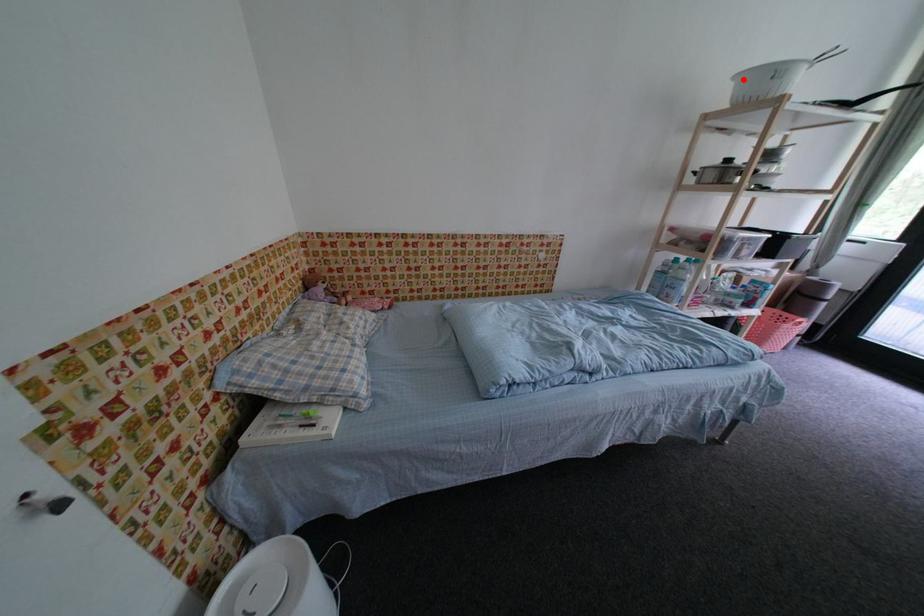
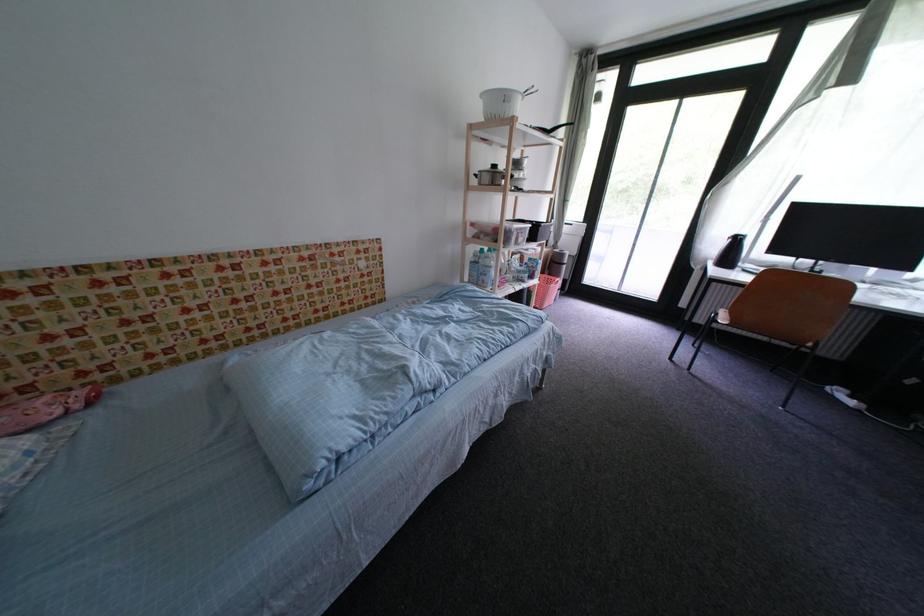
Find the pixel in the second image that matches the highlighted location in the first image.

(490, 98)